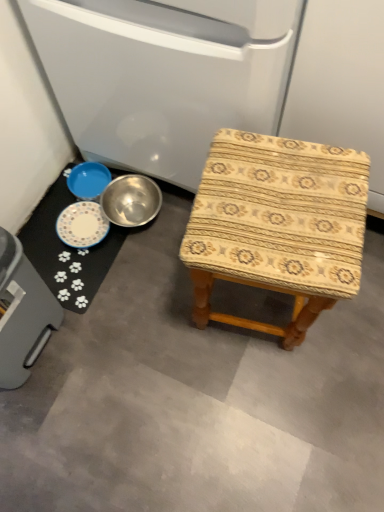
Find the location of a particular element. free space above white paw print mat at lower left (from a real-world perspective) is located at coordinates (78, 230).